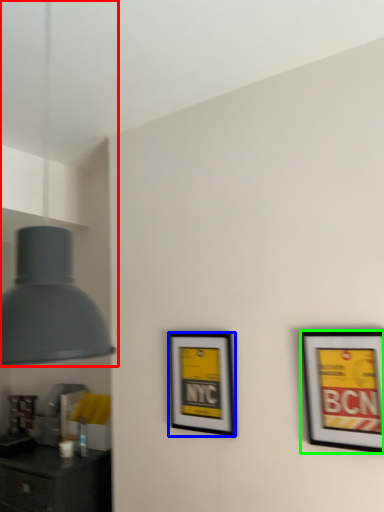
Question: Based on their relative distances, which object is nearer to lamp (highlighted by a red box)? Choose from picture frame (highlighted by a blue box) and picture frame (highlighted by a green box).

Choices:
 (A) picture frame
 (B) picture frame

Answer: (B)